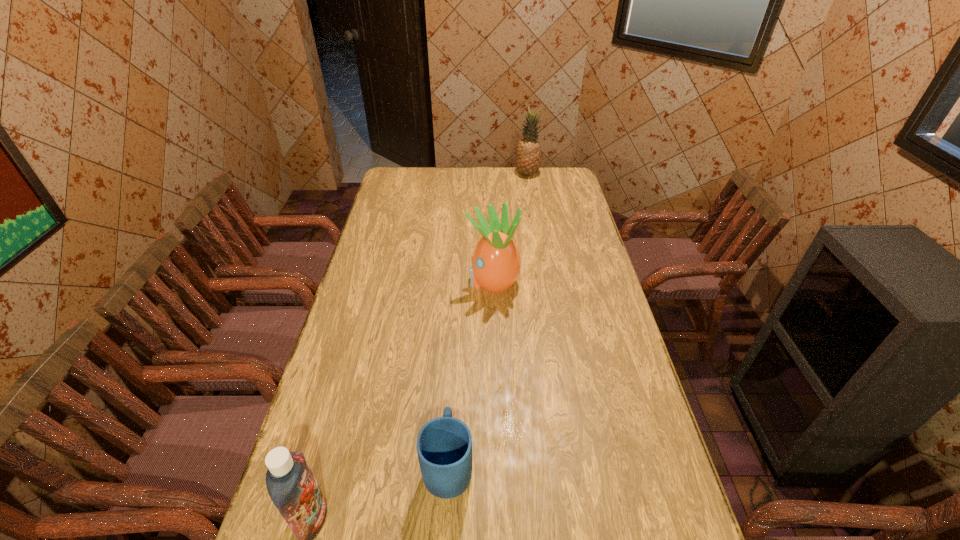
Identify the location of the farthest object. This screenshot has height=540, width=960. (528, 152).

Locate an element on the screen. The width and height of the screenshot is (960, 540). the rightmost object is located at coordinates (528, 152).

Image resolution: width=960 pixels, height=540 pixels. Find the location of `the second farthest object`. the second farthest object is located at coordinates (496, 262).

This screenshot has height=540, width=960. Identify the location of the nearer pineapple. (496, 262).

Image resolution: width=960 pixels, height=540 pixels. I want to click on mug, so click(x=444, y=445).

The width and height of the screenshot is (960, 540). I want to click on vacant area situated on the left of the farthest object, so click(x=485, y=174).

This screenshot has height=540, width=960. Identify the location of vacant space situated at the entrance of the nearer pineapple. (431, 281).

Find the location of a particular element. The height and width of the screenshot is (540, 960). free space located 0.100m at the entrance of the nearer pineapple is located at coordinates (x=440, y=281).

Locate an element on the screen. The height and width of the screenshot is (540, 960). vacant space located at the entrance of the nearer pineapple is located at coordinates (425, 281).

Where is `vacant space located 0.400m on the side of the mug with the handle`? vacant space located 0.400m on the side of the mug with the handle is located at coordinates (456, 322).